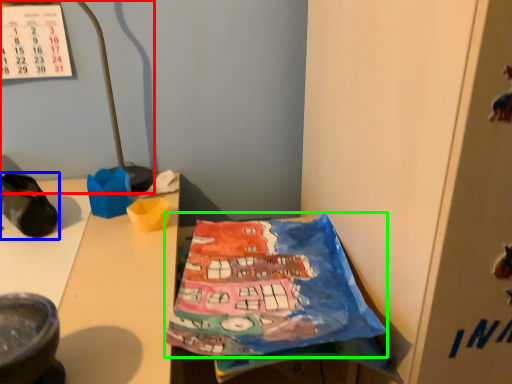
Question: Which object is the closest to the lamp (highlighted by a red box)? Choose among these: footwear (highlighted by a blue box) or wrapping paper (highlighted by a green box).

Choices:
 (A) footwear
 (B) wrapping paper

Answer: (A)